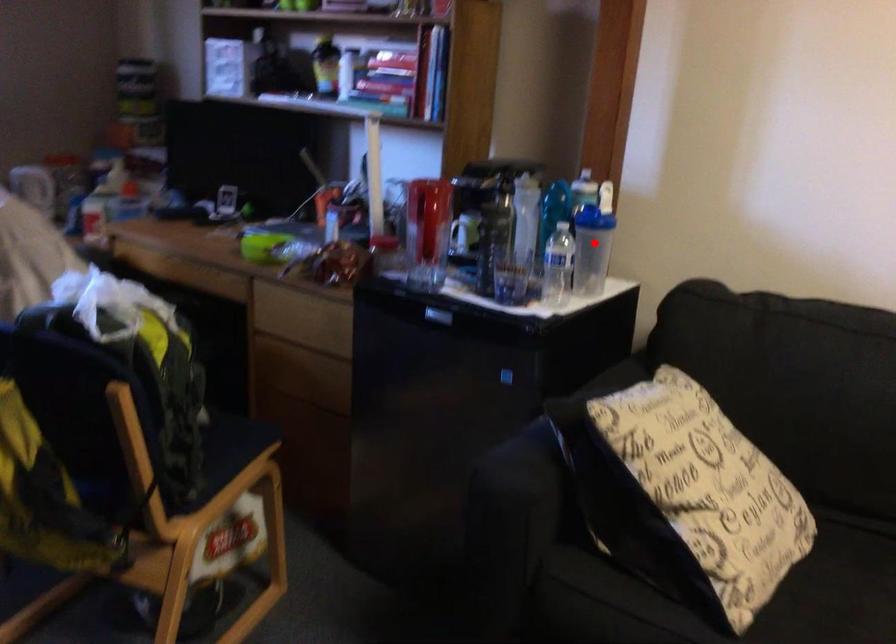
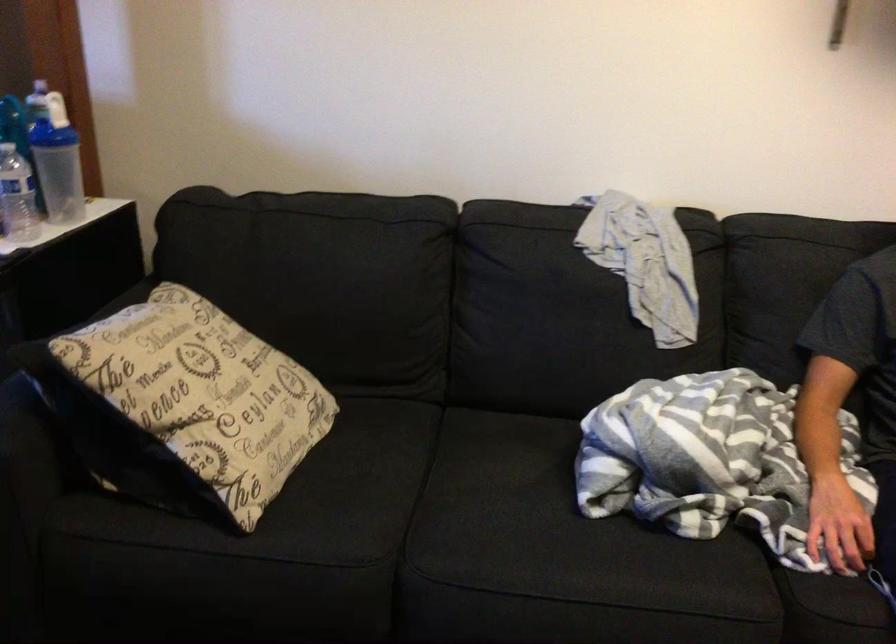
Question: I am providing you with two images of the same scene from different viewpoints. Image1 has a red point marked. In image2, the corresponding 3D location appears at what relative position? Reply with the corresponding letter.

Choices:
 (A) Closer
 (B) Farther

Answer: (A)